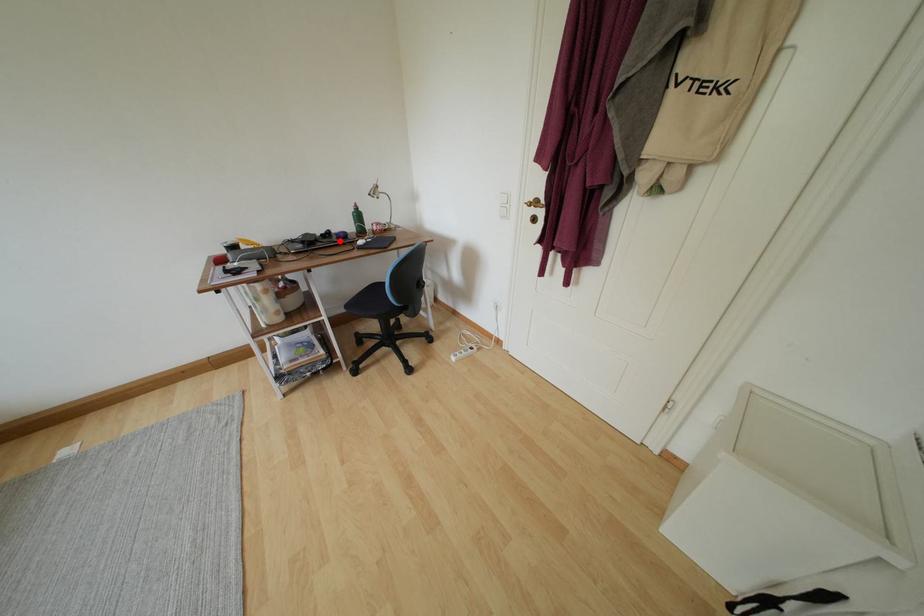
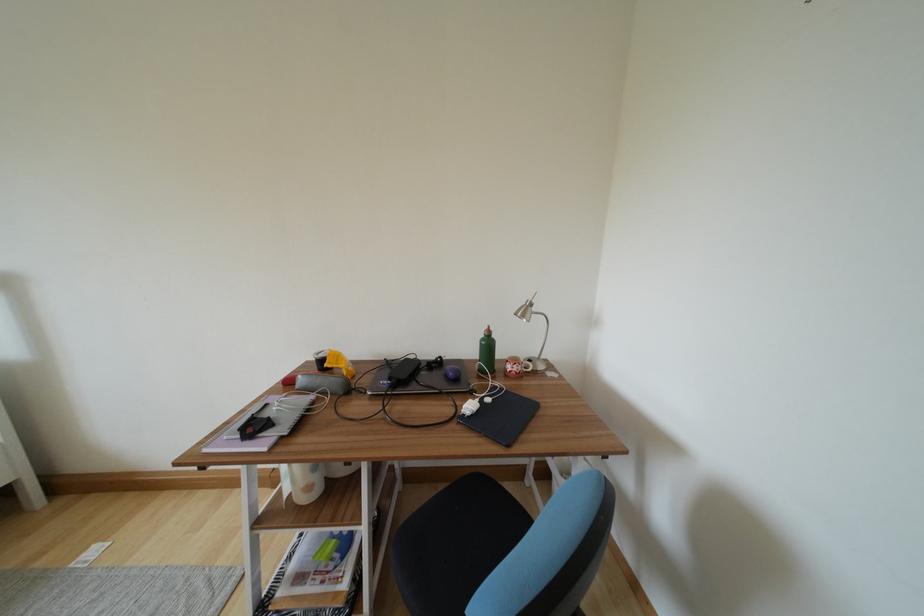
Find the pixel in the second image that matches the highlighted location in the first image.

(448, 376)